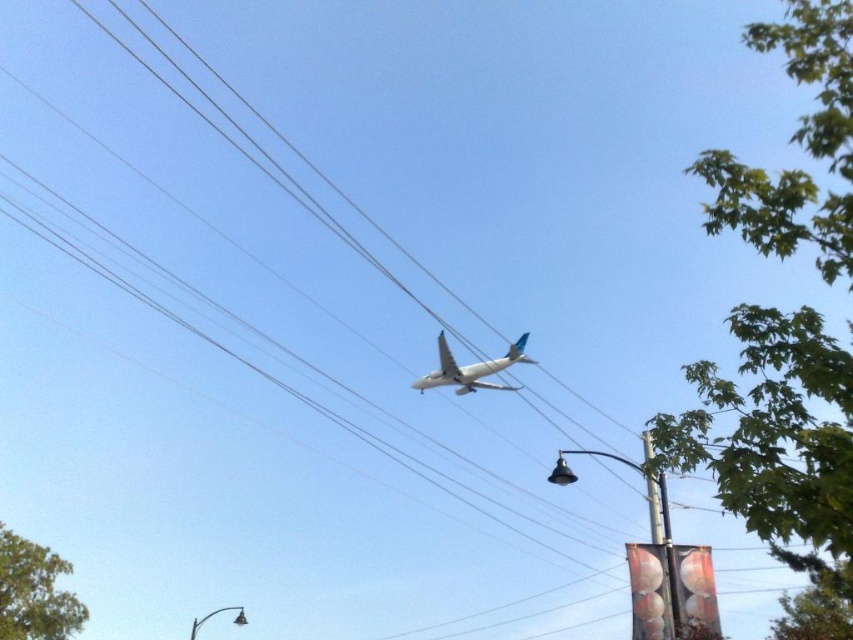
Question: Which point is farther to the camera?

Choices:
 (A) green leafy tree at lower left
 (B) metallic pole at right

Answer: (A)

Question: Is green leafy tree at upper right smaller than green leafy tree at lower left?

Choices:
 (A) no
 (B) yes

Answer: (A)

Question: Which of these objects is positioned closest to the white matte airplane at center?

Choices:
 (A) green leafy tree at upper right
 (B) metallic pole at right

Answer: (B)

Question: Does green leafy tree at upper right lie in front of metallic pole at right?

Choices:
 (A) no
 (B) yes

Answer: (B)

Question: Can you confirm if white matte airplane at center is positioned to the left of metallic pole at right?

Choices:
 (A) no
 (B) yes

Answer: (B)

Question: Which object is farther from the camera taking this photo?

Choices:
 (A) metallic pole at right
 (B) white matte airplane at center
 (C) green leafy tree at lower left

Answer: (C)